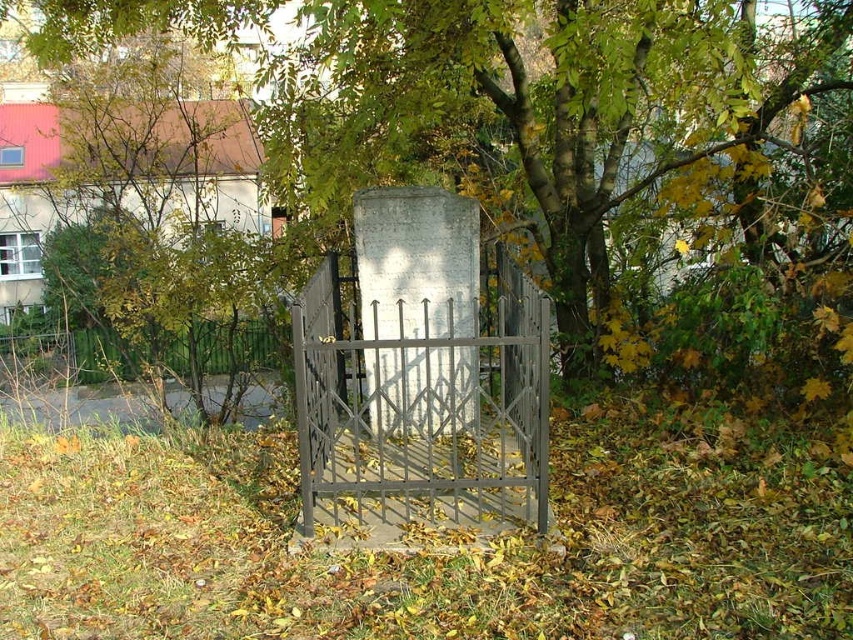
Question: Which point is farther to the camera?

Choices:
 (A) (378, 314)
 (B) (451, 86)

Answer: (B)

Question: Which object appears farthest from the camera in this image?

Choices:
 (A) dark gray wrought iron gate at center
 (B) green leafy tree at center

Answer: (B)

Question: Does green leafy tree at center appear under dark gray wrought iron gate at center?

Choices:
 (A) yes
 (B) no

Answer: (B)

Question: Considering the relative positions of green leafy tree at center and dark gray wrought iron gate at center in the image provided, where is green leafy tree at center located with respect to dark gray wrought iron gate at center?

Choices:
 (A) left
 (B) right

Answer: (A)

Question: Is green leafy tree at center bigger than dark gray wrought iron gate at center?

Choices:
 (A) yes
 (B) no

Answer: (B)